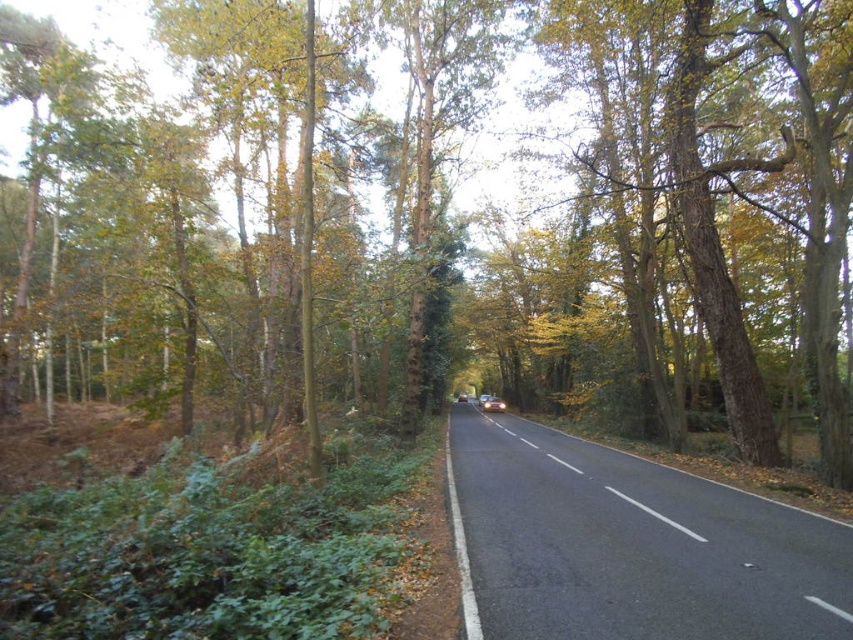
Looking at this image, you are a driver approaching the black asphalt road at center and see the metallic silver car at center ahead. Can you determine which object takes up more space in the image?

The black asphalt road at center has a larger size compared to the metallic silver car at center, so it takes up more space in the image.

You are standing at the starting point of the forest road and want to reach a specific location. There are two points marked on your map as point 1 at coordinates point (471,460) and point 2 at coordinates point (494,400). Based on the scene, which point is closer to you when you first arrive at the road?

Point (471,460) is closer to the viewer than point (494,400), so point 1 is closer to you when you first arrive at the road.